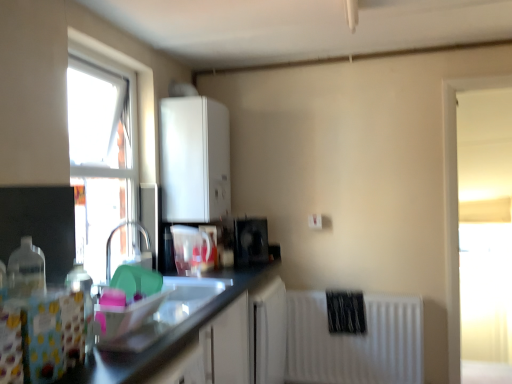
Question: Does white matte cabinet at upper center touch white matte radiator at lower right?

Choices:
 (A) no
 (B) yes

Answer: (A)

Question: Considering the relative sizes of white matte cabinet at upper center and white matte radiator at lower right in the image provided, is white matte cabinet at upper center thinner than white matte radiator at lower right?

Choices:
 (A) no
 (B) yes

Answer: (A)

Question: Does white matte cabinet at upper center appear on the right side of white matte radiator at lower right?

Choices:
 (A) no
 (B) yes

Answer: (A)

Question: Does white matte cabinet at upper center come behind white matte radiator at lower right?

Choices:
 (A) no
 (B) yes

Answer: (A)

Question: From the image's perspective, is white matte cabinet at upper center on white matte radiator at lower right?

Choices:
 (A) no
 (B) yes

Answer: (B)

Question: Does point coord(184,254) appear closer or farther from the camera than point coord(210,158)?

Choices:
 (A) closer
 (B) farther

Answer: (A)

Question: In terms of height, does transparent plastic pitcher at center, the 2th appliance from the back, look taller or shorter compared to white matte cabinet at upper center?

Choices:
 (A) tall
 (B) short

Answer: (B)

Question: From the image's perspective, is transparent plastic pitcher at center, which is the 2th appliance from right to left, located above or below white matte cabinet at upper center?

Choices:
 (A) below
 (B) above

Answer: (A)

Question: Would you say transparent plastic pitcher at center, which is counted as the 1th appliance, starting from the left, is inside or outside white matte cabinet at upper center?

Choices:
 (A) inside
 (B) outside

Answer: (B)

Question: Is white matte cabinet at upper center in front of or behind transparent glass window at upper left, which ranks as the second window in back-to-front order, in the image?

Choices:
 (A) behind
 (B) front

Answer: (A)

Question: From the image's perspective, is white matte cabinet at upper center located above or below transparent glass window at upper left, which ranks as the second window in back-to-front order?

Choices:
 (A) above
 (B) below

Answer: (A)

Question: Considering the positions of white matte cabinet at upper center and transparent glass window at upper left, which ranks as the second window in back-to-front order, in the image, is white matte cabinet at upper center taller or shorter than transparent glass window at upper left, which ranks as the second window in back-to-front order,?

Choices:
 (A) short
 (B) tall

Answer: (A)

Question: Does point (212, 190) appear closer or farther from the camera than point (68, 49)?

Choices:
 (A) closer
 (B) farther

Answer: (B)

Question: From a real-world perspective, is transparent glass window at upper left, the first window viewed from the left, positioned above or below black glossy speaker at center, marked as the first appliance in a right-to-left arrangement?

Choices:
 (A) below
 (B) above

Answer: (B)

Question: Do you think transparent glass window at upper left, the first window viewed from the left, is within black glossy speaker at center, which ranks as the first appliance in back-to-front order, or outside of it?

Choices:
 (A) inside
 (B) outside

Answer: (B)